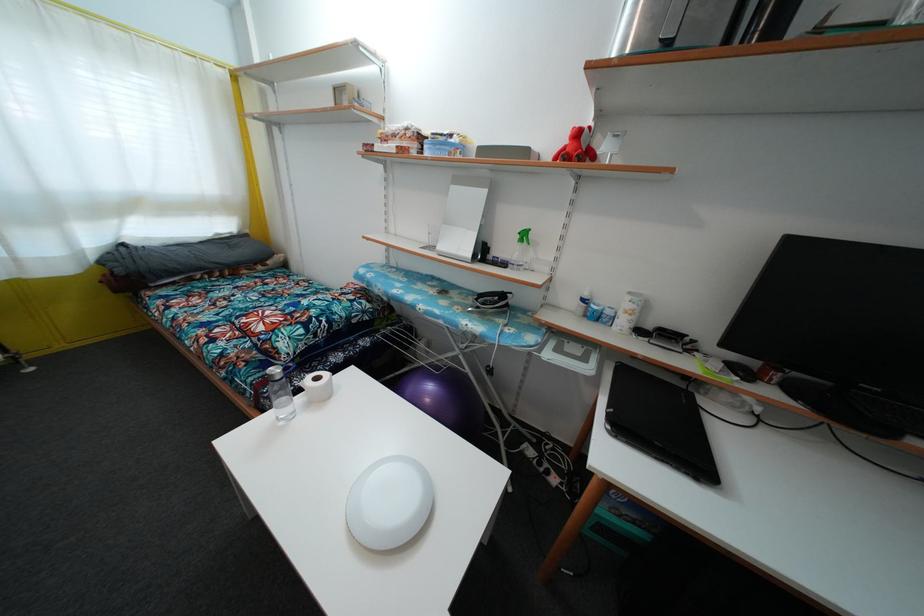
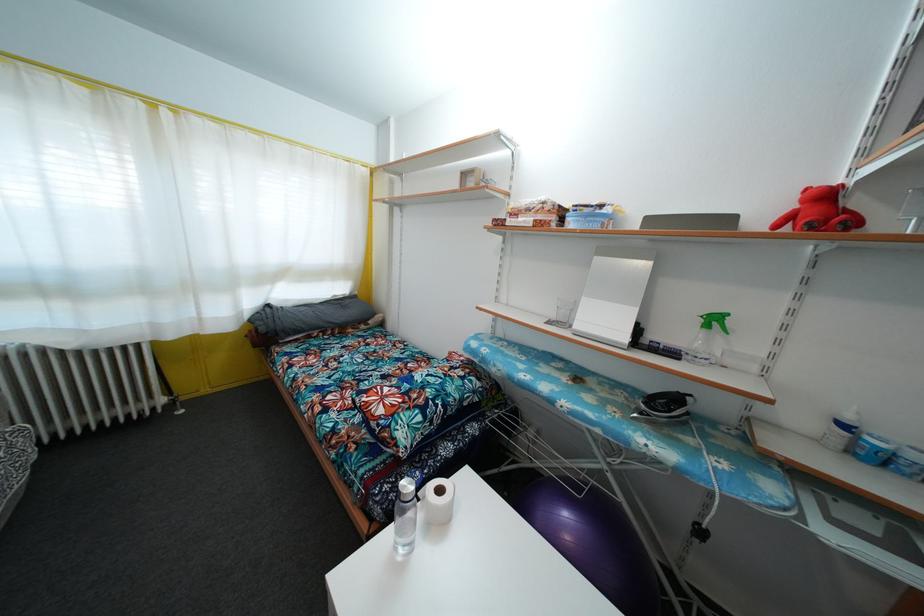
Find the pixel in the second image that matches (431,407) in the first image.

(572, 545)